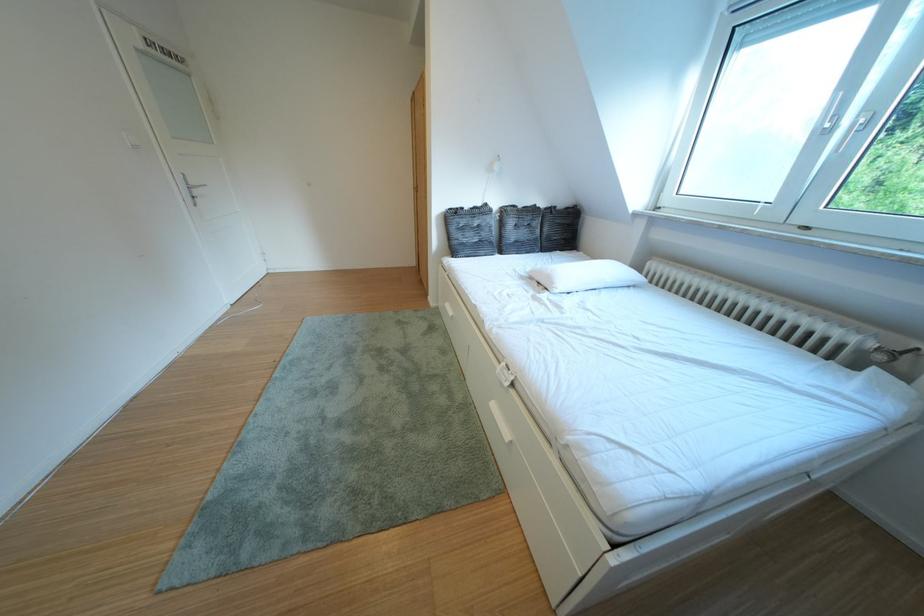
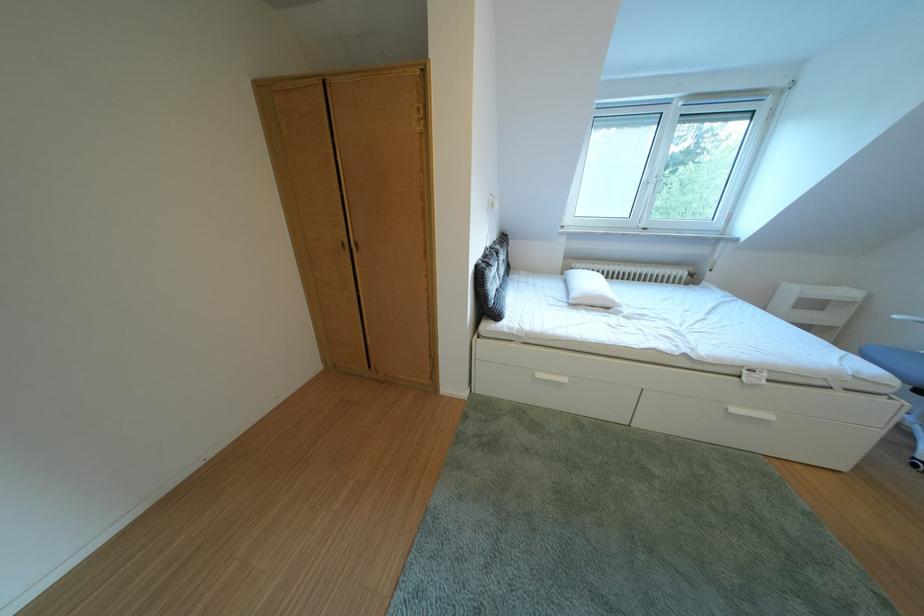
The point at (460, 310) is marked in the first image. Where is the corresponding point in the second image?

(553, 381)